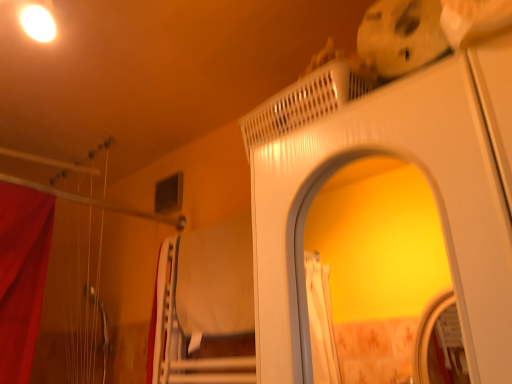
Question: Does white textured bed at center appear on the left side of white glossy screen door at upper center?

Choices:
 (A) yes
 (B) no

Answer: (A)

Question: Considering the relative sizes of white textured bed at center and white glossy screen door at upper center in the image provided, is white textured bed at center bigger than white glossy screen door at upper center?

Choices:
 (A) yes
 (B) no

Answer: (B)

Question: Is white textured bed at center smaller than white glossy screen door at upper center?

Choices:
 (A) no
 (B) yes

Answer: (B)

Question: Does white textured bed at center come behind white glossy screen door at upper center?

Choices:
 (A) yes
 (B) no

Answer: (A)

Question: From the image's perspective, is white textured bed at center above white glossy screen door at upper center?

Choices:
 (A) no
 (B) yes

Answer: (A)

Question: From a real-world perspective, is white textured bed at center above or below white fabric curtain at lower left?

Choices:
 (A) above
 (B) below

Answer: (A)

Question: Would you say white textured bed at center is to the left or to the right of white fabric curtain at lower left in the picture?

Choices:
 (A) left
 (B) right

Answer: (B)

Question: Is point (179, 365) closer or farther from the camera than point (159, 248)?

Choices:
 (A) closer
 (B) farther

Answer: (A)

Question: Do you think white textured bed at center is within white fabric curtain at lower left, or outside of it?

Choices:
 (A) outside
 (B) inside

Answer: (A)

Question: Is white glossy screen door at upper center to the left or to the right of white textured bed at center in the image?

Choices:
 (A) left
 (B) right

Answer: (B)

Question: Is white glossy screen door at upper center taller or shorter than white textured bed at center?

Choices:
 (A) tall
 (B) short

Answer: (A)

Question: From the image's perspective, is white glossy screen door at upper center above or below white textured bed at center?

Choices:
 (A) below
 (B) above

Answer: (B)

Question: Considering the positions of point (290, 235) and point (228, 337), is point (290, 235) closer or farther from the camera than point (228, 337)?

Choices:
 (A) farther
 (B) closer

Answer: (B)

Question: Is white textured bed at center wider or thinner than white glossy screen door at upper center?

Choices:
 (A) thin
 (B) wide

Answer: (A)

Question: Is white textured bed at center taller or shorter than white glossy screen door at upper center?

Choices:
 (A) short
 (B) tall

Answer: (A)